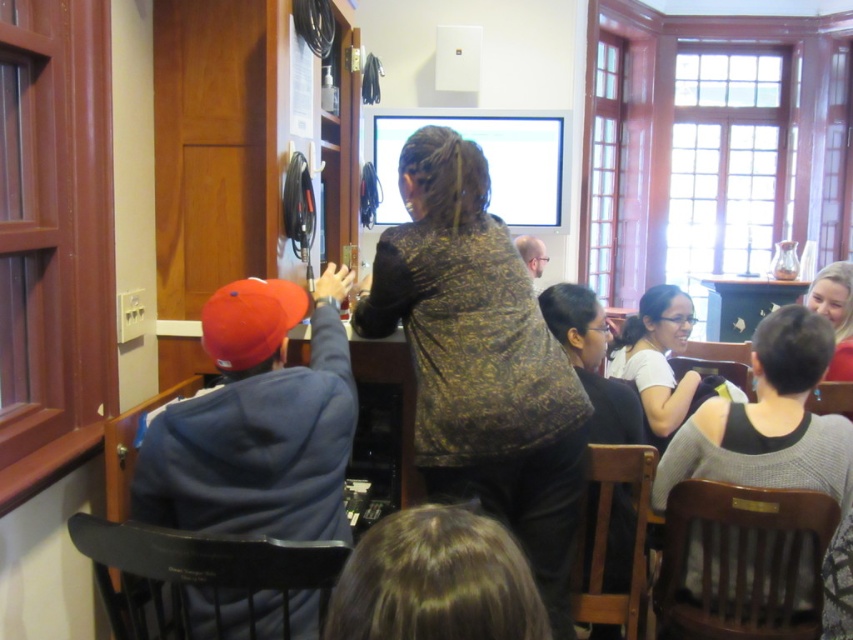
Question: Is white matte shirt at center to the right of matte black hair at upper right from the viewer's perspective?

Choices:
 (A) no
 (B) yes

Answer: (A)

Question: Which of these objects is positioned closest to the gold textured jacket at center?

Choices:
 (A) white matte shirt at center
 (B) gray knit sweater at lower right
 (C) matte black hair at upper right
 (D) wooden table at upper right

Answer: (B)

Question: Among these points, which one is farthest from the camera?

Choices:
 (A) (799, 461)
 (B) (844, 305)

Answer: (B)

Question: Is gold textured jacket at center closer to the viewer compared to white matte shirt at center?

Choices:
 (A) no
 (B) yes

Answer: (B)

Question: Does white matte shirt at center appear over wooden table at upper right?

Choices:
 (A) yes
 (B) no

Answer: (B)

Question: Which object appears closest to the camera in this image?

Choices:
 (A) gold textured jacket at center
 (B) matte black hair at upper right

Answer: (A)